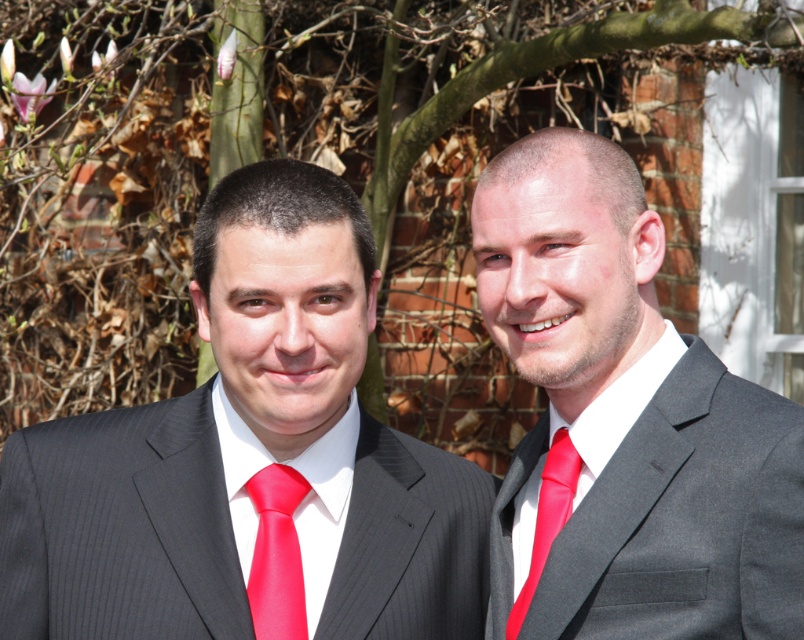
Question: Can you confirm if matte black suit at left is positioned to the left of matte red tie at right?

Choices:
 (A) yes
 (B) no

Answer: (A)

Question: Which point is closer to the camera?

Choices:
 (A) matte red tie at right
 (B) red satin tie at center
 (C) matte black suit at left
 (D) matte black suit at center

Answer: (D)

Question: Considering the relative positions of matte black suit at left and matte black suit at center in the image provided, where is matte black suit at left located with respect to matte black suit at center?

Choices:
 (A) below
 (B) above

Answer: (A)

Question: Considering the relative positions of matte black suit at center and red satin tie at center in the image provided, where is matte black suit at center located with respect to red satin tie at center?

Choices:
 (A) right
 (B) left

Answer: (A)

Question: Which object is the farthest from the red satin tie at center?

Choices:
 (A) matte red tie at right
 (B) matte black suit at left

Answer: (A)

Question: Considering the real-world distances, which object is closest to the red satin tie at center?

Choices:
 (A) matte black suit at center
 (B) matte red tie at right

Answer: (B)